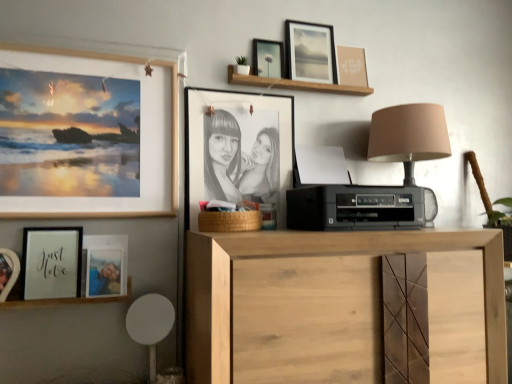
Question: Is matte wooden photo frame at lower left, positioned as the fourth picture frame in left-to-right order, surrounding white plastic swivel chair at lower left?

Choices:
 (A) no
 (B) yes

Answer: (A)

Question: From the image's perspective, would you say matte wooden photo frame at lower left, arranged as the fifth picture frame when viewed from the right, is shown under white plastic swivel chair at lower left?

Choices:
 (A) yes
 (B) no

Answer: (B)

Question: From a real-world perspective, is matte wooden photo frame at lower left, positioned as the fourth picture frame in left-to-right order, below white plastic swivel chair at lower left?

Choices:
 (A) no
 (B) yes

Answer: (A)

Question: Is matte wooden photo frame at lower left, arranged as the fifth picture frame when viewed from the right, at the right side of white plastic swivel chair at lower left?

Choices:
 (A) no
 (B) yes

Answer: (A)

Question: Is matte wooden photo frame at lower left, arranged as the fifth picture frame when viewed from the right, far away from white plastic swivel chair at lower left?

Choices:
 (A) yes
 (B) no

Answer: (B)

Question: Does matte wooden photo frame at lower left, arranged as the fifth picture frame when viewed from the right, have a larger size compared to white plastic swivel chair at lower left?

Choices:
 (A) yes
 (B) no

Answer: (B)

Question: From the image's perspective, is wooden shelf at upper center, positioned as the 2th shelf in left-to-right order, under matte wooden photo frame at lower left, positioned as the fourth picture frame in left-to-right order?

Choices:
 (A) yes
 (B) no

Answer: (B)

Question: Is matte wooden photo frame at lower left, positioned as the fourth picture frame in left-to-right order, located within wooden shelf at upper center, which ranks as the 1th shelf in top-to-bottom order?

Choices:
 (A) no
 (B) yes

Answer: (A)

Question: Is wooden shelf at upper center, positioned as the 2th shelf in left-to-right order, at the right side of matte wooden photo frame at lower left, positioned as the fourth picture frame in left-to-right order?

Choices:
 (A) yes
 (B) no

Answer: (A)

Question: Is wooden shelf at upper center, the second shelf viewed from the front, smaller than matte wooden photo frame at lower left, positioned as the fourth picture frame in left-to-right order?

Choices:
 (A) yes
 (B) no

Answer: (A)

Question: From a real-world perspective, is wooden shelf at upper center, acting as the 2th shelf starting from the bottom, positioned over matte wooden photo frame at lower left, positioned as the fourth picture frame in left-to-right order, based on gravity?

Choices:
 (A) no
 (B) yes

Answer: (B)

Question: Is the depth of wooden shelf at upper center, the second shelf viewed from the front, greater than that of matte wooden photo frame at lower left, positioned as the fourth picture frame in left-to-right order?

Choices:
 (A) yes
 (B) no

Answer: (A)

Question: Is the depth of natural wood cabinet at center greater than that of matte black frame at upper center, which is counted as the 6th picture frame, starting from the left?

Choices:
 (A) yes
 (B) no

Answer: (B)